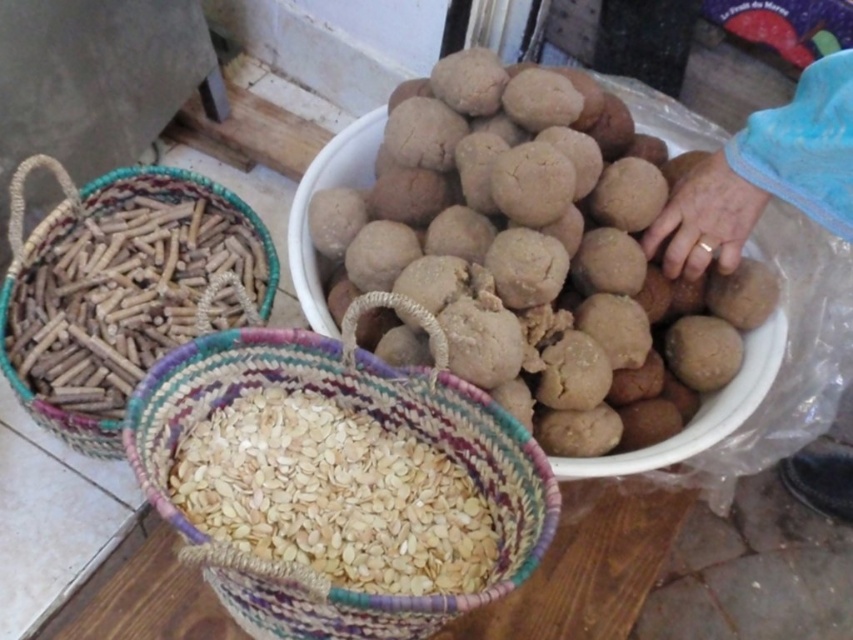
Who is higher up, brown matte dough balls at center or braided straw basket filled with seeds at center?

brown matte dough balls at center is higher up.

Is brown matte dough balls at center below braided straw basket filled with seeds at center?

Incorrect, brown matte dough balls at center is not positioned below braided straw basket filled with seeds at center.

What do you see at coordinates (494, 196) in the screenshot?
I see `brown matte dough balls at center` at bounding box center [494, 196].

The width and height of the screenshot is (853, 640). What are the coordinates of `brown matte dough balls at center` in the screenshot? It's located at [x=494, y=196].

Which is behind, point (534, 172) or point (312, 461)?

Point (312, 461)

Looking at this image, is brown matte dough balls at center bigger than light brown woven basket at lower center?

Correct, brown matte dough balls at center is larger in size than light brown woven basket at lower center.

Locate an element on the screen. The image size is (853, 640). brown matte dough balls at center is located at coordinates (494, 196).

In the scene shown: Does light brown woven basket at lower center have a smaller size compared to blue fabric hand at right?

Correct, light brown woven basket at lower center occupies less space than blue fabric hand at right.

Is point (323, 472) farther from viewer compared to point (746, 193)?

No, it is in front of (746, 193).

Locate an element on the screen. light brown woven basket at lower center is located at coordinates (334, 493).